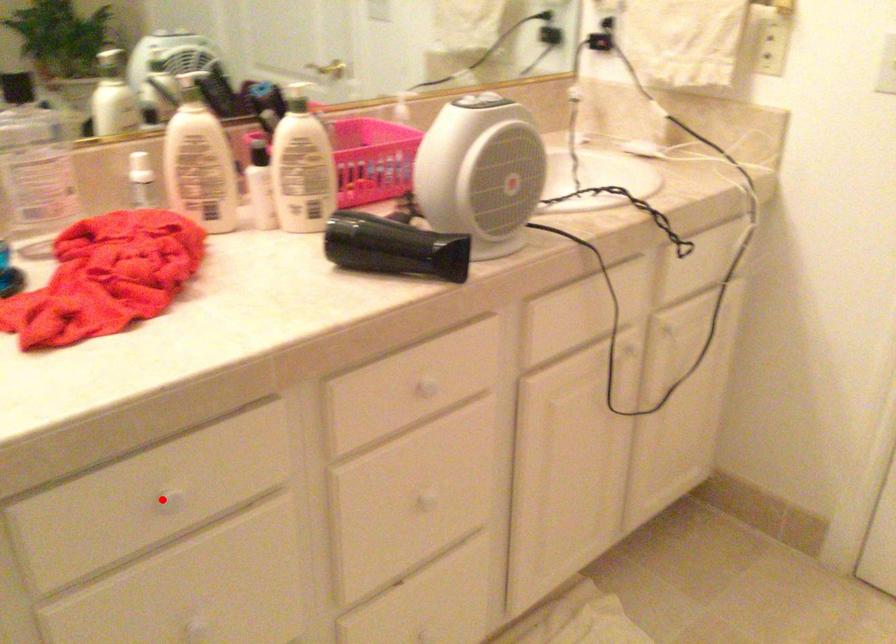
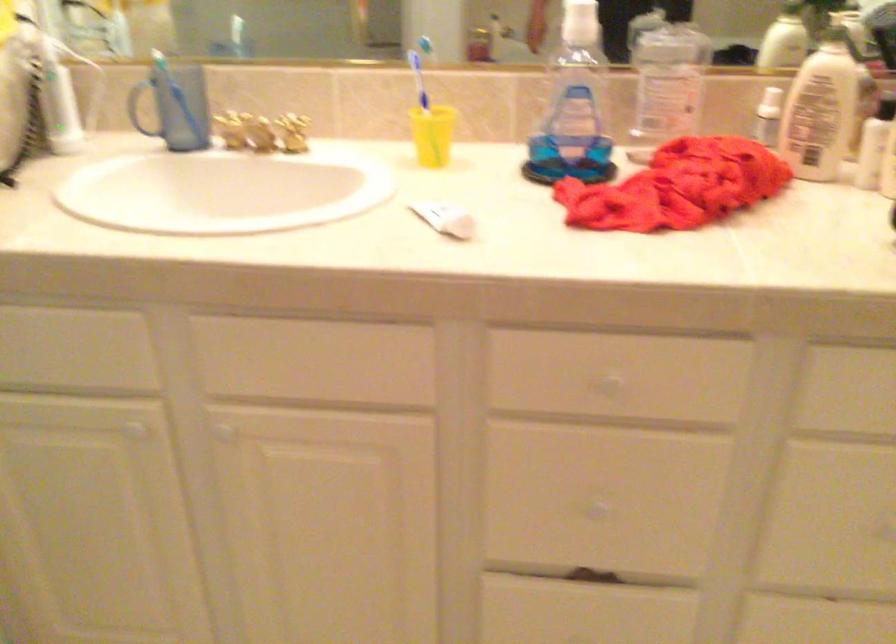
In the second image, find the point that corresponds to the highlighted location in the first image.

(609, 384)